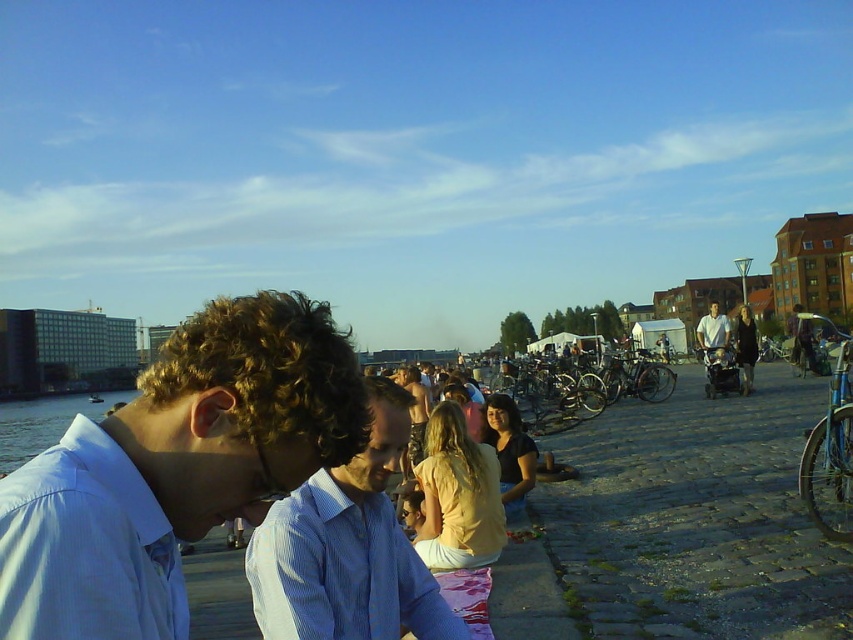
I want to click on blue striped shirt at center, so click(x=347, y=548).

From the picture: How distant is blue striped shirt at center from blue metallic bicycle at right?

blue striped shirt at center is 35.43 feet from blue metallic bicycle at right.

Who is more distant from viewer, (335, 513) or (834, 474)?

Point (834, 474)

The width and height of the screenshot is (853, 640). I want to click on blue striped shirt at center, so (x=347, y=548).

Can you confirm if metallic blue bicycle at center-right is shorter than light blue shirt at center?

Yes.

Can you confirm if metallic blue bicycle at center-right is thinner than light blue shirt at center?

Yes.

Find the location of a particular element. metallic blue bicycle at center-right is located at coordinates click(x=721, y=372).

Who is more distant from viewer, (830, 484) or (729, 385)?

Point (729, 385)

Can you confirm if blue metallic bicycle at right is shorter than metallic blue bicycle at center-right?

In fact, blue metallic bicycle at right may be taller than metallic blue bicycle at center-right.

Between point (831, 496) and point (728, 365), which one is positioned behind?

Point (728, 365)

This screenshot has width=853, height=640. I want to click on blue metallic bicycle at right, so click(831, 452).